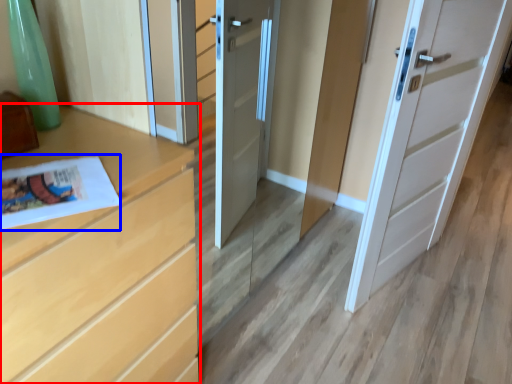
Question: Which point is further to the camera, chest of drawers (highlighted by a red box) or magazine (highlighted by a blue box)?

Choices:
 (A) chest of drawers
 (B) magazine

Answer: (B)